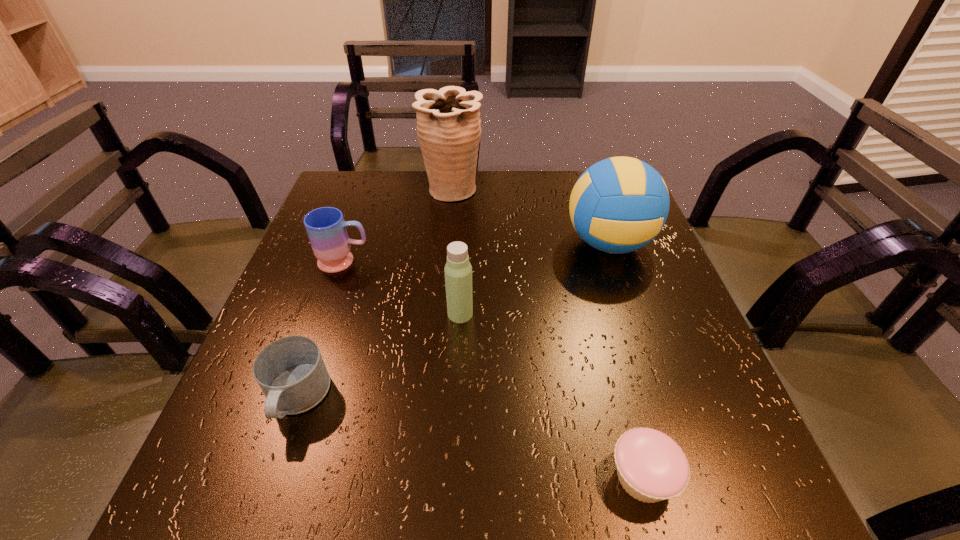
Where is `the shortest object`? This screenshot has width=960, height=540. the shortest object is located at coordinates (651, 467).

This screenshot has height=540, width=960. In order to click on blank space located on the right of the farthest object in this screenshot , I will do `click(614, 189)`.

I want to click on vacant space located 0.360m on the front of the fifth shortest object, so click(x=669, y=421).

What are the coordinates of `vacant space located on the back of the third nearest object` in the screenshot? It's located at (462, 288).

At what (x,y) coordinates should I click in order to perform the action: click on vacant area situated 0.360m on the side of the farther mug with the handle. Please return your answer as a coordinate pair (x, y). The height and width of the screenshot is (540, 960). Looking at the image, I should click on (528, 261).

The height and width of the screenshot is (540, 960). What are the coordinates of `vacant area situated on the side of the shorter mug with the handle` in the screenshot? It's located at (258, 510).

You are a GUI agent. You are given a task and a screenshot of the screen. Output one action in this format:
    pyautogui.click(x=<x>, y=<y>)
    Task: Click on the vacant space located on the back of the nearest object
    The width and height of the screenshot is (960, 540).
    Given the screenshot: What is the action you would take?
    pyautogui.click(x=593, y=291)

You are a GUI agent. You are given a task and a screenshot of the screen. Output one action in this format:
    pyautogui.click(x=<x>, y=<y>)
    Task: Click on the urn at the far edge
    This screenshot has width=960, height=540.
    Given the screenshot: What is the action you would take?
    pyautogui.click(x=448, y=121)

Locate an element on the screen. This screenshot has height=540, width=960. volleyball that is at the far edge is located at coordinates (618, 205).

What are the coordinates of `object present at the near edge` in the screenshot? It's located at (651, 467).